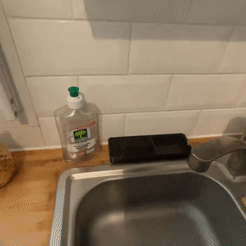
Locate an element on the screen. The image size is (246, 246). black soap/sponge holder is located at coordinates (147, 167).